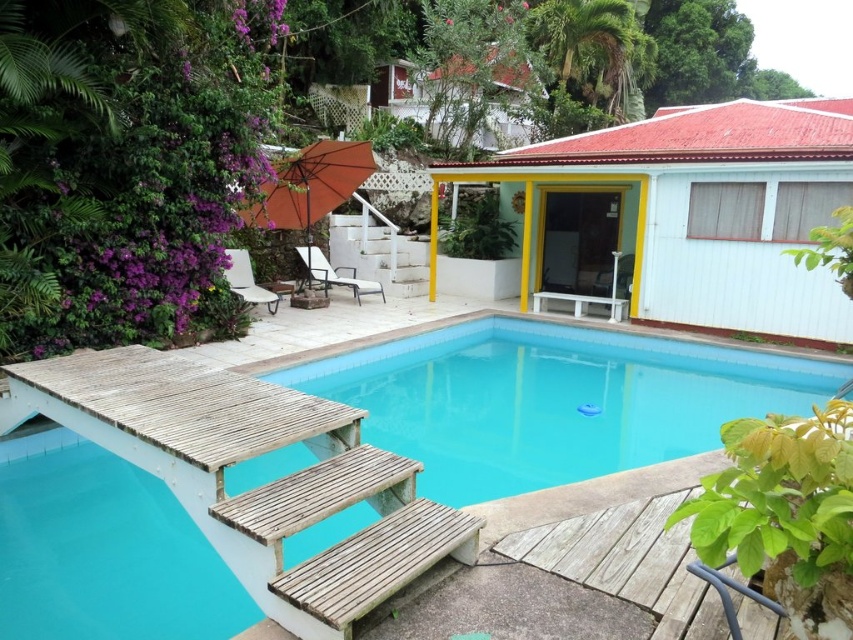
You are standing in the backyard and want to walk from the wooden staircase to the orange umbrella. Which point, point (325, 268) or point (242, 278), is closer to your path?

Point (325, 268) is further to the viewer than point (242, 278), so the closer point to your path would be point (242, 278).